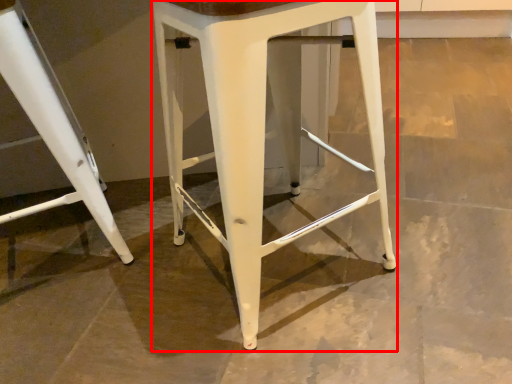
Question: From the image, what is the correct spatial relationship of stool (annotated by the red box) in relation to stool?

Choices:
 (A) left
 (B) right

Answer: (B)